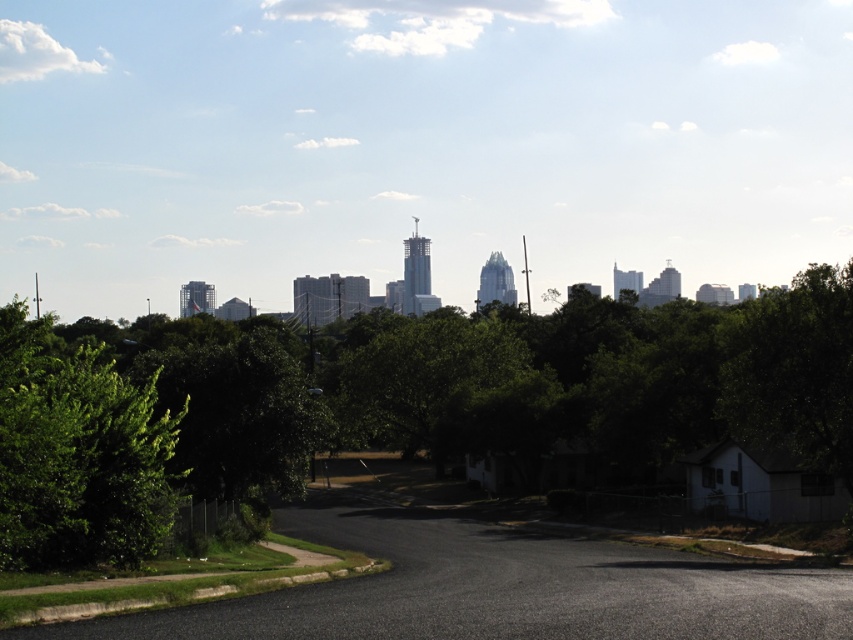
You are standing at the origin point of the image coordinate system. The image coordinate system has its origin at the bottom left corner. Which direction should you move to reach the green leafy tree at center?

Since the green leafy tree at center is located at point coordinates of 0.634 on the x axis and 0.495 on the y axis, you should move to the right and slightly upwards from the origin to reach it.

You are a landscape architect designing a walking path between the green leafy tree at center and the green leafy tree at left. Which tree requires a wider path to accommodate its width?

The green leafy tree at center requires a wider path because it might be wider than the green leafy tree at left.